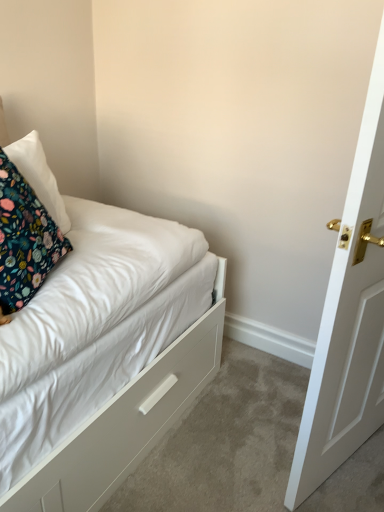
Question: Can you confirm if floral fabric pillow at upper left, the 2th pillow positioned from the front, is bigger than floral fabric pillow at left, acting as the 2th pillow starting from the back?

Choices:
 (A) no
 (B) yes

Answer: (A)

Question: Considering the relative sizes of floral fabric pillow at upper left, the 2th pillow positioned from the front, and floral fabric pillow at left, acting as the 2th pillow starting from the back, in the image provided, is floral fabric pillow at upper left, the 2th pillow positioned from the front, taller than floral fabric pillow at left, acting as the 2th pillow starting from the back,?

Choices:
 (A) no
 (B) yes

Answer: (A)

Question: Can you confirm if floral fabric pillow at upper left, the 2th pillow positioned from the front, is thinner than floral fabric pillow at left, the first pillow viewed from the front?

Choices:
 (A) yes
 (B) no

Answer: (B)

Question: Considering the relative sizes of floral fabric pillow at upper left, the 2th pillow positioned from the front, and floral fabric pillow at left, acting as the 2th pillow starting from the back, in the image provided, is floral fabric pillow at upper left, the 2th pillow positioned from the front, smaller than floral fabric pillow at left, acting as the 2th pillow starting from the back,?

Choices:
 (A) yes
 (B) no

Answer: (A)

Question: From a real-world perspective, does floral fabric pillow at upper left, the 2th pillow positioned from the front, sit lower than floral fabric pillow at left, acting as the 2th pillow starting from the back?

Choices:
 (A) yes
 (B) no

Answer: (B)

Question: Is floral fabric pillow at upper left, the 2th pillow positioned from the front, at the right side of floral fabric pillow at left, acting as the 2th pillow starting from the back?

Choices:
 (A) no
 (B) yes

Answer: (A)

Question: Can you confirm if white matte drawer at lower left is shorter than floral fabric pillow at upper left, the first pillow from the back?

Choices:
 (A) no
 (B) yes

Answer: (B)

Question: From the image's perspective, does white matte drawer at lower left appear higher than floral fabric pillow at upper left, the first pillow from the back?

Choices:
 (A) yes
 (B) no

Answer: (B)

Question: Is white matte drawer at lower left behind floral fabric pillow at upper left, the first pillow from the back?

Choices:
 (A) no
 (B) yes

Answer: (A)

Question: From the image's perspective, is white matte drawer at lower left beneath floral fabric pillow at upper left, the 2th pillow positioned from the front?

Choices:
 (A) no
 (B) yes

Answer: (B)

Question: Could you tell me if white matte drawer at lower left is turned towards floral fabric pillow at upper left, the first pillow from the back?

Choices:
 (A) no
 (B) yes

Answer: (A)

Question: Is white matte drawer at lower left to the right of floral fabric pillow at upper left, the first pillow from the back, from the viewer's perspective?

Choices:
 (A) no
 (B) yes

Answer: (B)

Question: From the image's perspective, is floral fabric pillow at left, acting as the 2th pillow starting from the back, above floral fabric pillow at upper left, the 2th pillow positioned from the front?

Choices:
 (A) no
 (B) yes

Answer: (A)